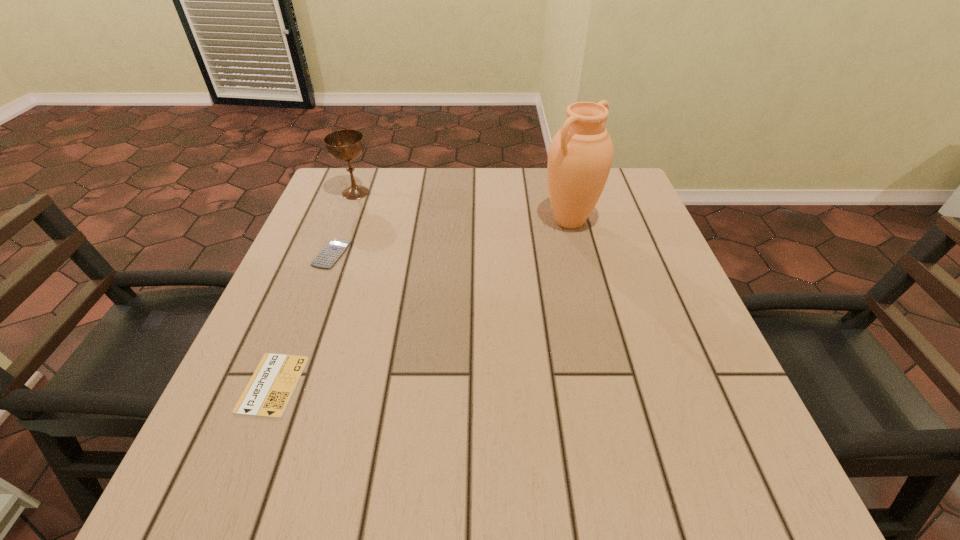
Locate an element on the screen. vacant region located on the front of the calculator is located at coordinates (301, 334).

Locate an element on the screen. This screenshot has height=540, width=960. blank area located 0.310m on the right of the identity card is located at coordinates (482, 384).

You are a GUI agent. You are given a task and a screenshot of the screen. Output one action in this format:
    pyautogui.click(x=<x>, y=<y>)
    Task: Click on the urn positioned at the far edge
    This screenshot has height=540, width=960.
    Given the screenshot: What is the action you would take?
    pyautogui.click(x=580, y=155)

In order to click on chalice located at the far edge in this screenshot , I will do `click(344, 145)`.

Find the location of a particular element. chalice that is at the left edge is located at coordinates (344, 145).

This screenshot has height=540, width=960. I want to click on calculator situated at the left edge, so click(x=332, y=251).

This screenshot has height=540, width=960. In order to click on identity card at the left edge in this screenshot , I will do pyautogui.click(x=270, y=388).

Find the location of `object positioned at the right edge`. object positioned at the right edge is located at coordinates (580, 155).

Find the location of a particular element. Image resolution: width=960 pixels, height=540 pixels. object that is at the far left corner is located at coordinates (344, 145).

The height and width of the screenshot is (540, 960). What are the coordinates of `object located in the far right corner section of the desktop` in the screenshot? It's located at (580, 155).